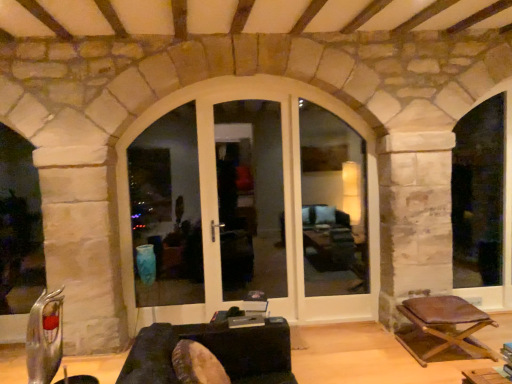
Question: Is white glossy door at center, the 3th window frame viewed from the right, thinner than white wood window frame at right, the third window frame positioned from the left?

Choices:
 (A) no
 (B) yes

Answer: (B)

Question: Is white glossy door at center, acting as the 1th window frame starting from the left, positioned far away from white wood window frame at right, positioned as the 1th window frame in right-to-left order?

Choices:
 (A) yes
 (B) no

Answer: (A)

Question: Is white glossy door at center, the 3th window frame viewed from the right, facing towards white wood window frame at right, the third window frame positioned from the left?

Choices:
 (A) no
 (B) yes

Answer: (A)

Question: Does white glossy door at center, the 3th window frame viewed from the right, have a greater height compared to white wood window frame at right, the third window frame positioned from the left?

Choices:
 (A) no
 (B) yes

Answer: (A)

Question: Is the depth of white glossy door at center, the 3th window frame viewed from the right, less than that of white wood window frame at right, positioned as the 1th window frame in right-to-left order?

Choices:
 (A) no
 (B) yes

Answer: (B)

Question: In terms of height, does dark brown leather couch at center look taller or shorter compared to white glossy door at center, the 3th window frame viewed from the right?

Choices:
 (A) tall
 (B) short

Answer: (B)

Question: Which is correct: dark brown leather couch at center is inside white glossy door at center, the 3th window frame viewed from the right, or outside of it?

Choices:
 (A) inside
 (B) outside

Answer: (B)

Question: In terms of width, does dark brown leather couch at center look wider or thinner when compared to white glossy door at center, the 3th window frame viewed from the right?

Choices:
 (A) thin
 (B) wide

Answer: (B)

Question: From the image's perspective, is dark brown leather couch at center positioned above or below white glossy door at center, acting as the 1th window frame starting from the left?

Choices:
 (A) above
 (B) below

Answer: (B)

Question: Do you think white wood window frame at right, positioned as the 1th window frame in right-to-left order, is within brown leather stool at lower right, or outside of it?

Choices:
 (A) inside
 (B) outside

Answer: (B)

Question: From a real-world perspective, is white wood window frame at right, positioned as the 1th window frame in right-to-left order, positioned above or below brown leather stool at lower right?

Choices:
 (A) above
 (B) below

Answer: (A)

Question: Does point (459, 125) appear closer or farther from the camera than point (470, 336)?

Choices:
 (A) closer
 (B) farther

Answer: (B)

Question: Considering the positions of white wood window frame at right, positioned as the 1th window frame in right-to-left order, and brown leather stool at lower right in the image, is white wood window frame at right, positioned as the 1th window frame in right-to-left order, wider or thinner than brown leather stool at lower right?

Choices:
 (A) thin
 (B) wide

Answer: (A)

Question: Is white glass door at center to the left or to the right of brown leather stool at lower right in the image?

Choices:
 (A) right
 (B) left

Answer: (B)

Question: Is white glass door at center spatially inside brown leather stool at lower right, or outside of it?

Choices:
 (A) outside
 (B) inside

Answer: (A)